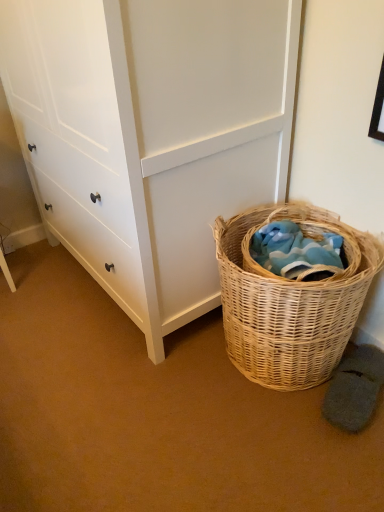
Question: From a real-world perspective, is woven natural basket at lower right on top of white matte chest of drawers at center?

Choices:
 (A) yes
 (B) no

Answer: (B)

Question: Is woven natural basket at lower right located outside white matte chest of drawers at center?

Choices:
 (A) no
 (B) yes

Answer: (B)

Question: Is the position of woven natural basket at lower right less distant than that of white matte chest of drawers at center?

Choices:
 (A) yes
 (B) no

Answer: (B)

Question: Considering the relative sizes of woven natural basket at lower right and white matte chest of drawers at center in the image provided, is woven natural basket at lower right thinner than white matte chest of drawers at center?

Choices:
 (A) yes
 (B) no

Answer: (A)

Question: Considering the relative positions of woven natural basket at lower right and white matte chest of drawers at center in the image provided, is woven natural basket at lower right to the right of white matte chest of drawers at center from the viewer's perspective?

Choices:
 (A) yes
 (B) no

Answer: (A)

Question: Is woven natural basket at lower right positioned far away from white matte chest of drawers at center?

Choices:
 (A) no
 (B) yes

Answer: (A)

Question: Is white matte chest of drawers at center outside woven natural basket at lower right?

Choices:
 (A) yes
 (B) no

Answer: (A)

Question: Is the surface of white matte chest of drawers at center in direct contact with woven natural basket at lower right?

Choices:
 (A) no
 (B) yes

Answer: (A)

Question: Is white matte chest of drawers at center wider than woven natural basket at lower right?

Choices:
 (A) yes
 (B) no

Answer: (A)

Question: Considering the relative positions of white matte chest of drawers at center and woven natural basket at lower right in the image provided, is white matte chest of drawers at center to the left of woven natural basket at lower right from the viewer's perspective?

Choices:
 (A) yes
 (B) no

Answer: (A)

Question: Does white matte chest of drawers at center have a lesser height compared to woven natural basket at lower right?

Choices:
 (A) yes
 (B) no

Answer: (B)

Question: Does white matte chest of drawers at center appear on the right side of woven natural basket at lower right?

Choices:
 (A) no
 (B) yes

Answer: (A)

Question: From a real-world perspective, is white matte chest of drawers at center physically located above or below woven natural basket at lower right?

Choices:
 (A) below
 (B) above

Answer: (B)